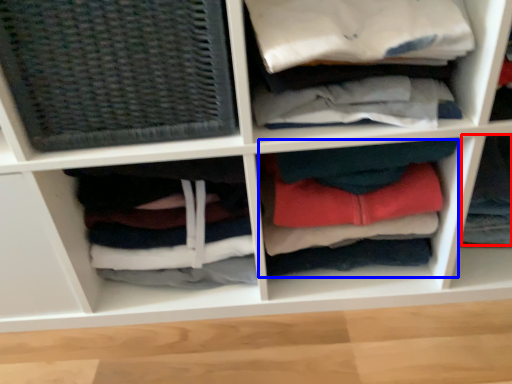
Question: Which of the following is the closest to the observer, clothing (highlighted by a red box) or clothing (highlighted by a blue box)?

Choices:
 (A) clothing
 (B) clothing

Answer: (B)